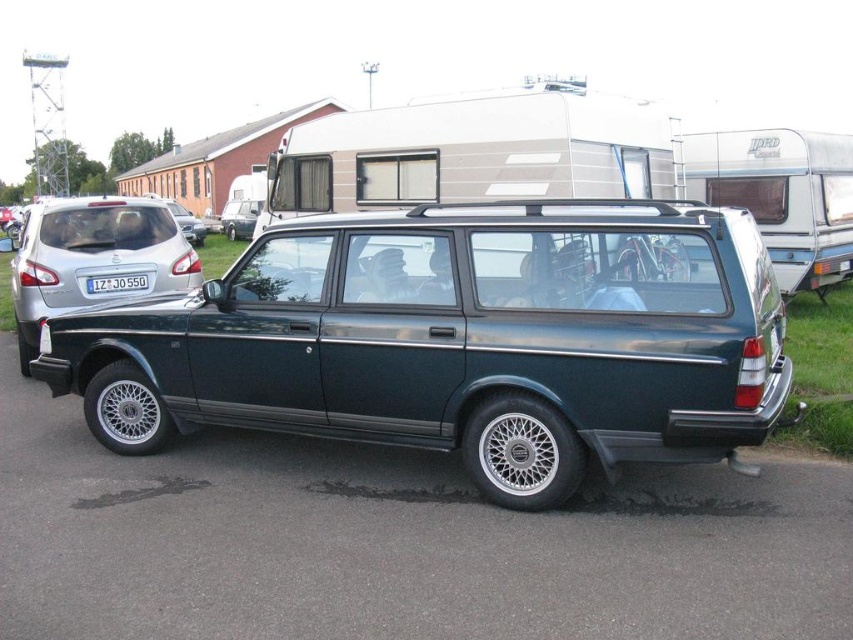
You are a delivery driver who needs to park your truck next to the metallic green station wagon at center without blocking the metallic silver pickup truck at upper right. The parking space between them is 8.49 meters. If your truck is 5 meters long, will there be enough space?

The distance between the metallic green station wagon at center and the metallic silver pickup truck at upper right is 8.49 meters. Since your truck is 5 meters long, there will be enough space to park without blocking either vehicle.

You are standing at the entrance of the car show and want to find the metallic green station wagon at center. According to the coordinates provided, where should you look relative to the entrance?

The metallic green station wagon at center is located at coordinates approximately 0.533 on the x and 0.538 on the y axis, which would be near the center of the image. Since you are at the entrance, you should look towards the center of the venue where the car is displayed.